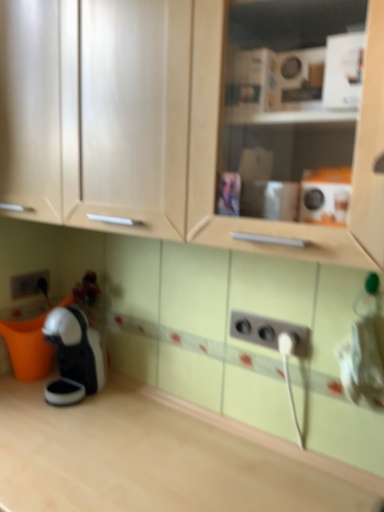
Question: Is matte gray electric outlet at lower left, which ranks as the 2th electric outlet in bottom-to-top order, taller or shorter than light wood countertop at lower left?

Choices:
 (A) tall
 (B) short

Answer: (B)

Question: From a real-world perspective, is matte gray electric outlet at lower left, the second electric outlet from the front, above or below light wood countertop at lower left?

Choices:
 (A) above
 (B) below

Answer: (A)

Question: Which object is positioned farthest from the black plastic coffee machine at lower left?

Choices:
 (A) light wood countertop at lower left
 (B) white plastic outlet at lower center, marked as the 2th electric outlet in a back-to-front arrangement
 (C) matte gray electric outlet at lower left, which is the 1th electric outlet from back to front
 (D) matte wood cabinet at upper center

Answer: (D)

Question: Which object is positioned farthest from the matte wood cabinet at upper center?

Choices:
 (A) black plastic coffee machine at lower left
 (B) matte gray electric outlet at lower left, which ranks as the 2th electric outlet in bottom-to-top order
 (C) white plastic outlet at lower center, acting as the 1th electric outlet starting from the front
 (D) light wood countertop at lower left

Answer: (B)